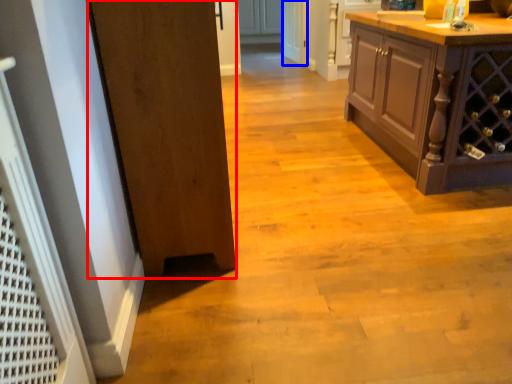
Question: Which object appears farthest to the camera in this image, door (highlighted by a red box) or screen door (highlighted by a blue box)?

Choices:
 (A) door
 (B) screen door

Answer: (B)